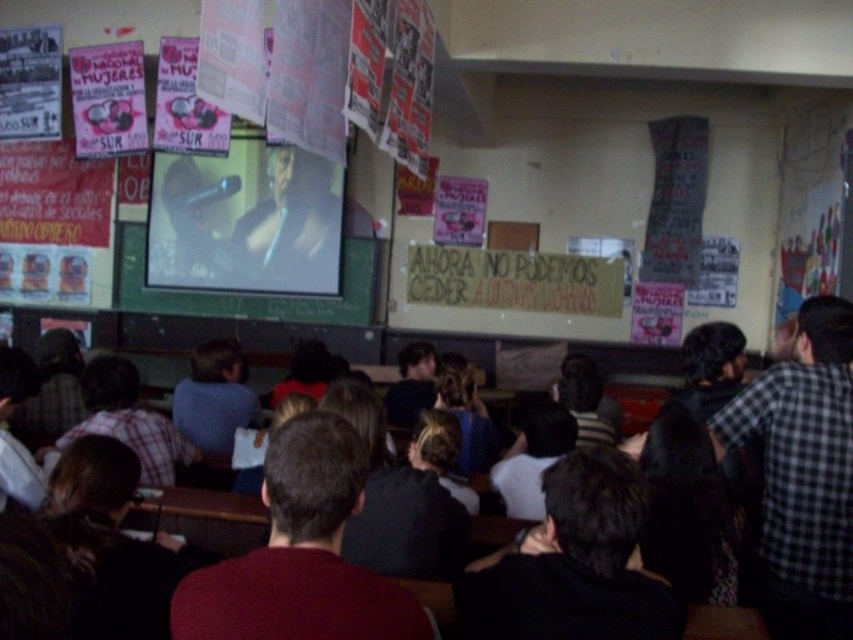
Which of the two shirts, the dark red shirt at center or the checkered fabric shirt at right, is shorter?

The dark red shirt at center is shorter than the checkered fabric shirt at right.

What is the exact location of the smooth black shirt at center in the image?

The smooth black shirt at center is located at point (292,227).